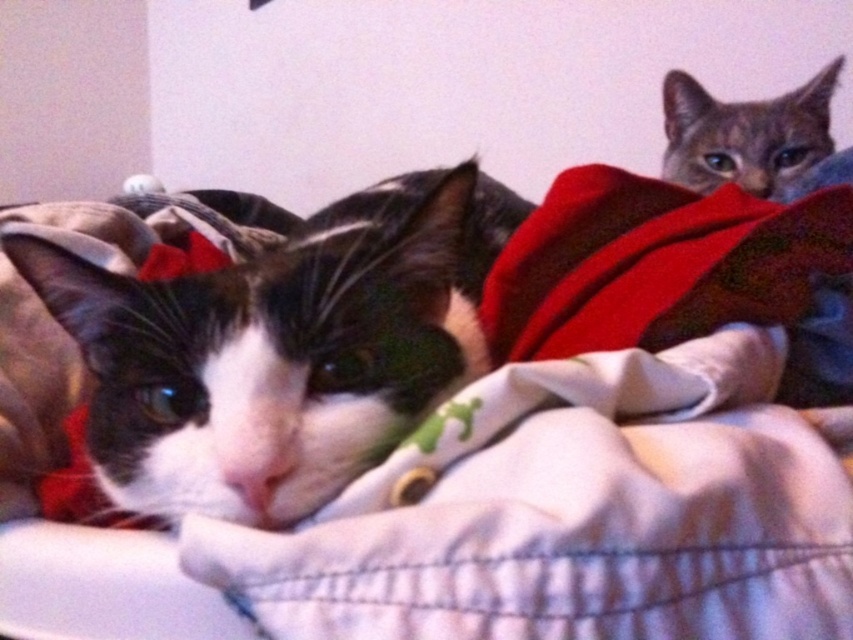
Question: Considering the relative positions of black and white fur cat at left and gray tabby cat at upper right in the image provided, where is black and white fur cat at left located with respect to gray tabby cat at upper right?

Choices:
 (A) right
 (B) left

Answer: (B)

Question: Does black and white fur cat at left have a lesser width compared to gray tabby cat at upper right?

Choices:
 (A) no
 (B) yes

Answer: (A)

Question: Which of the following is the closest to the observer?

Choices:
 (A) (781, 106)
 (B) (115, 394)

Answer: (B)

Question: Which object is farther from the camera taking this photo?

Choices:
 (A) gray tabby cat at upper right
 (B) black and white fur cat at left

Answer: (A)

Question: Can you confirm if black and white fur cat at left is smaller than gray tabby cat at upper right?

Choices:
 (A) yes
 (B) no

Answer: (B)